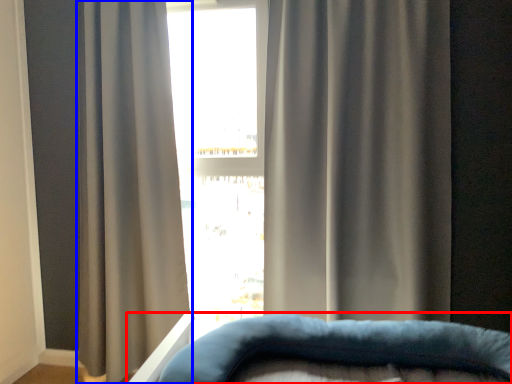
Question: Which object appears farthest to the camera in this image, furniture (highlighted by a red box) or curtain (highlighted by a blue box)?

Choices:
 (A) furniture
 (B) curtain

Answer: (B)